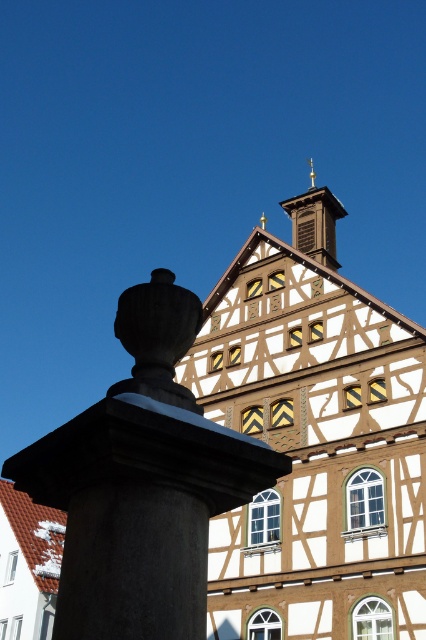
Question: Is the position of smooth stone column at left more distant than that of wooden bell tower at upper center?

Choices:
 (A) yes
 (B) no

Answer: (B)

Question: Is smooth stone column at left in front of wooden bell tower at upper center?

Choices:
 (A) yes
 (B) no

Answer: (A)

Question: In this image, where is smooth stone column at left located relative to wooden bell tower at upper center?

Choices:
 (A) below
 (B) above

Answer: (A)

Question: Which point appears closest to the camera in this image?

Choices:
 (A) (98, 529)
 (B) (293, 237)

Answer: (A)